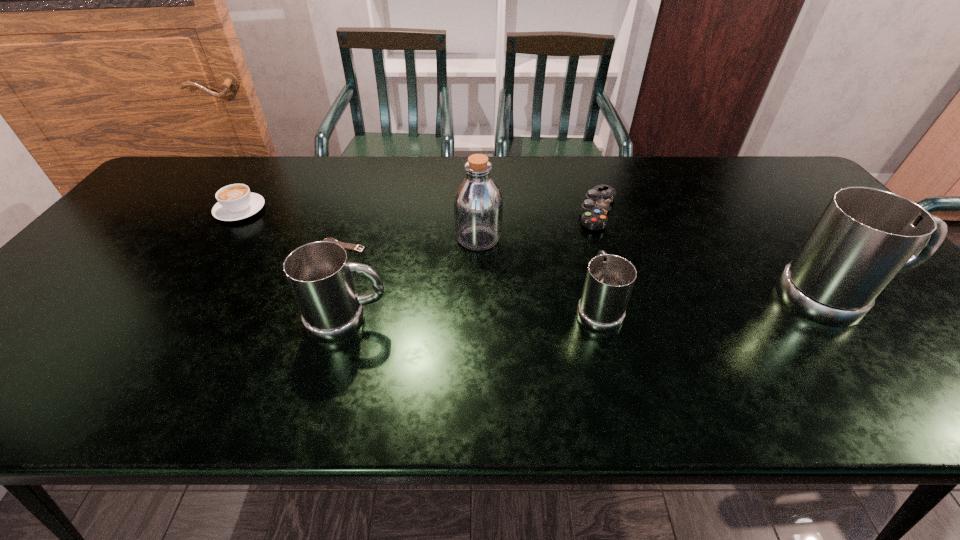
Find the location of a particular element. This screenshot has width=960, height=540. blank area in the image that satisfies the following two spatial constraints: 1. on the front side of the second shortest object; 2. on the side of the leftmost mug with the handle is located at coordinates pos(634,320).

Locate an element on the screen. The width and height of the screenshot is (960, 540). free space that satisfies the following two spatial constraints: 1. on the back side of the watch; 2. on the right side of the second shortest object is located at coordinates (355, 211).